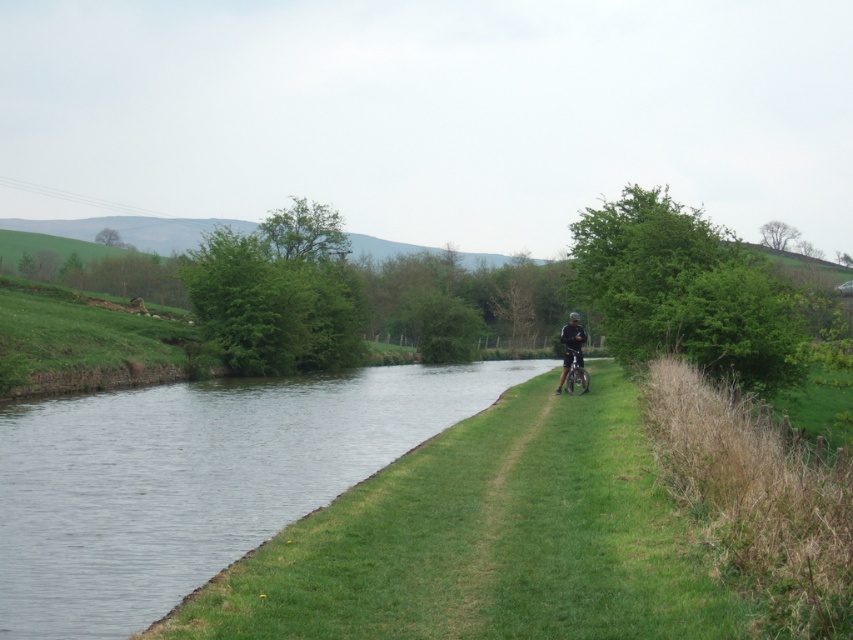
Question: Which of the following is the closest to the observer?

Choices:
 (A) dark blue fabric jacket at center
 (B) clear water at right

Answer: (B)

Question: Is clear water at right further to the viewer compared to dark blue fabric jacket at center?

Choices:
 (A) no
 (B) yes

Answer: (A)

Question: Where is clear water at right located in relation to dark blue fabric jacket at center in the image?

Choices:
 (A) above
 (B) below

Answer: (B)

Question: Is clear water at right thinner than dark blue fabric jacket at center?

Choices:
 (A) yes
 (B) no

Answer: (B)